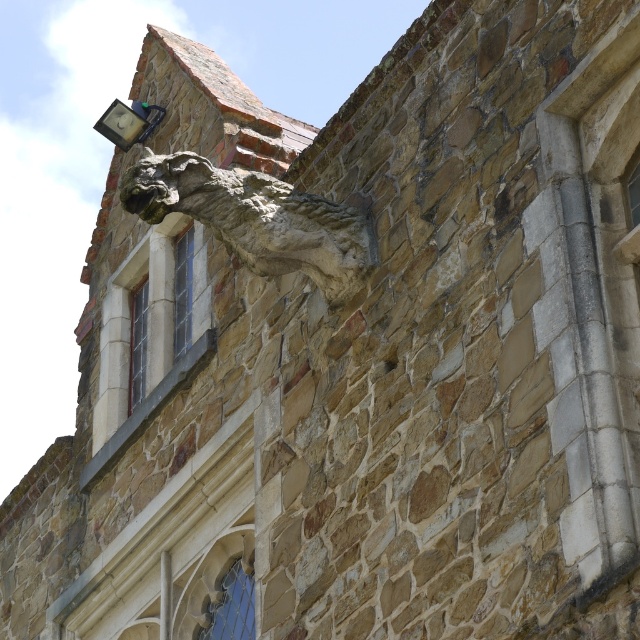
Between point (308, 218) and point (99, 124), which one is positioned in front?

Point (308, 218) is more forward.

Is point (252, 264) closer to camera compared to point (102, 124)?

Yes.

Between point (140, 173) and point (140, 125), which one is positioned behind?

The point (140, 125) is behind.

Where is `stone gargoyle at upper center`? Image resolution: width=640 pixels, height=640 pixels. stone gargoyle at upper center is located at coordinates (257, 220).

Does clear glass window at center appear over clear glass window at upper center?

Indeed, clear glass window at center is positioned over clear glass window at upper center.

Is clear glass window at center thinner than clear glass window at upper center?

In fact, clear glass window at center might be wider than clear glass window at upper center.

The image size is (640, 640). Identify the location of clear glass window at center. (182, 291).

Identify the location of clear glass window at center. The image size is (640, 640). (182, 291).

Does metallic stone gargoyle at upper left have a smaller size compared to clear glass window at upper center?

Actually, metallic stone gargoyle at upper left might be larger than clear glass window at upper center.

Can you confirm if metallic stone gargoyle at upper left is taller than clear glass window at upper center?

Indeed, metallic stone gargoyle at upper left has a greater height compared to clear glass window at upper center.

Which is in front, point (120, 120) or point (134, 323)?

Point (134, 323) is in front.

I want to click on metallic stone gargoyle at upper left, so click(x=129, y=122).